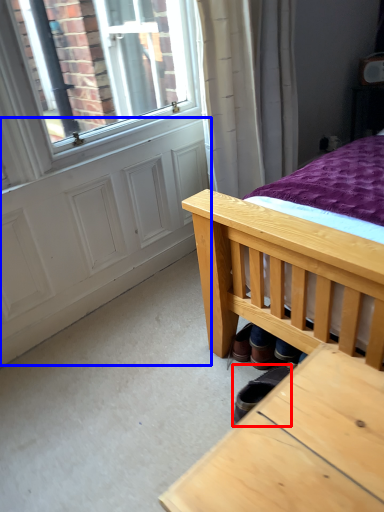
Question: Among these objects, which one is nearest to the camera, footwear (highlighted by a red box) or screen door (highlighted by a blue box)?

Choices:
 (A) footwear
 (B) screen door

Answer: (A)